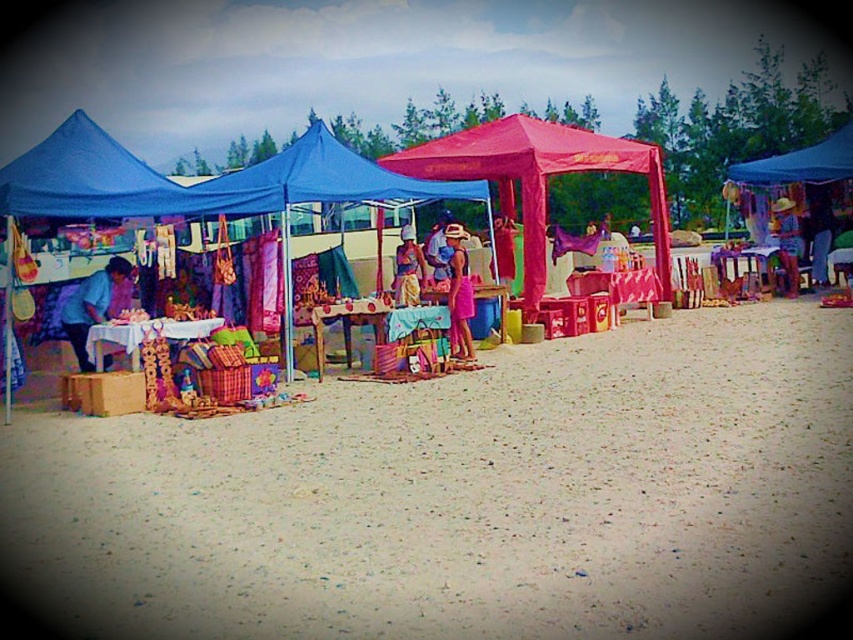
This screenshot has height=640, width=853. What do you see at coordinates (213, 180) in the screenshot? I see `matte pink fabric tent at center` at bounding box center [213, 180].

Does point (204, 202) lie behind point (90, 300)?

Yes.

Where is `matte pink fabric tent at center`? This screenshot has width=853, height=640. matte pink fabric tent at center is located at coordinates (213, 180).

Describe the element at coordinates (467, 497) in the screenshot. I see `beige sandy beach at center` at that location.

Is point (650, 513) positioned behind point (541, 184)?

That is False.

Does point (85, 492) come farther from viewer compared to point (666, 284)?

No, (85, 492) is closer to viewer.

Where is `beige sandy beach at center`? The image size is (853, 640). beige sandy beach at center is located at coordinates (467, 497).

Between point (404, 202) and point (543, 132), which one is positioned behind?

Point (543, 132)

Which is below, matte pink fabric tent at center or pink fabric canopy at center?

Positioned lower is matte pink fabric tent at center.

Which is behind, point (102, 218) or point (531, 314)?

Point (531, 314)

Image resolution: width=853 pixels, height=640 pixels. I want to click on matte pink fabric tent at center, so click(213, 180).